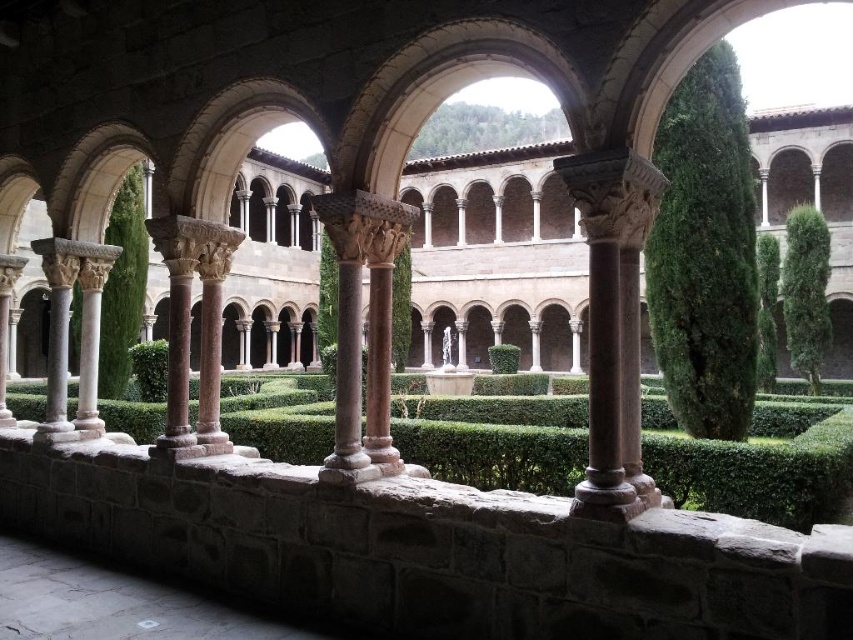
Does green leafy hedge at left appear on the right side of green leafy hedge at center?

No, green leafy hedge at left is not to the right of green leafy hedge at center.

Based on the photo, does green leafy hedge at left appear on the left side of green leafy hedge at center?

Indeed, green leafy hedge at left is positioned on the left side of green leafy hedge at center.

Find the location of a particular element. The image size is (853, 640). green leafy hedge at left is located at coordinates (122, 285).

You are a GUI agent. You are given a task and a screenshot of the screen. Output one action in this format:
    pyautogui.click(x=<x>, y=<y>)
    Task: Click on the green leafy hedge at left
    
    Given the screenshot: What is the action you would take?
    pyautogui.click(x=122, y=285)

Find the location of a particular element. This screenshot has height=640, width=853. green textured hedge at center is located at coordinates (758, 461).

Does green textured hedge at center lie in front of polished stone column at center?

No.

Locate an element on the screen. green textured hedge at center is located at coordinates (758, 461).

Can you confirm if polished stone column at center is bigger than green leafy hedge at left?

Actually, polished stone column at center might be smaller than green leafy hedge at left.

Who is more forward, (x=379, y=365) or (x=126, y=353)?

Point (x=379, y=365)

Where is `polished stone column at center`? polished stone column at center is located at coordinates (361, 328).